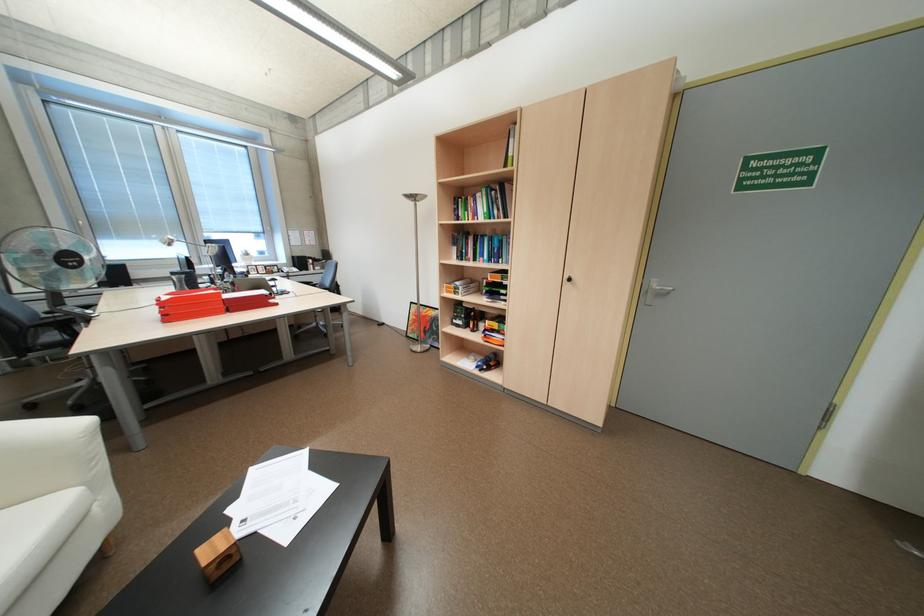
In order to click on sofa sitting surface in this screenshot , I will do `click(27, 530)`.